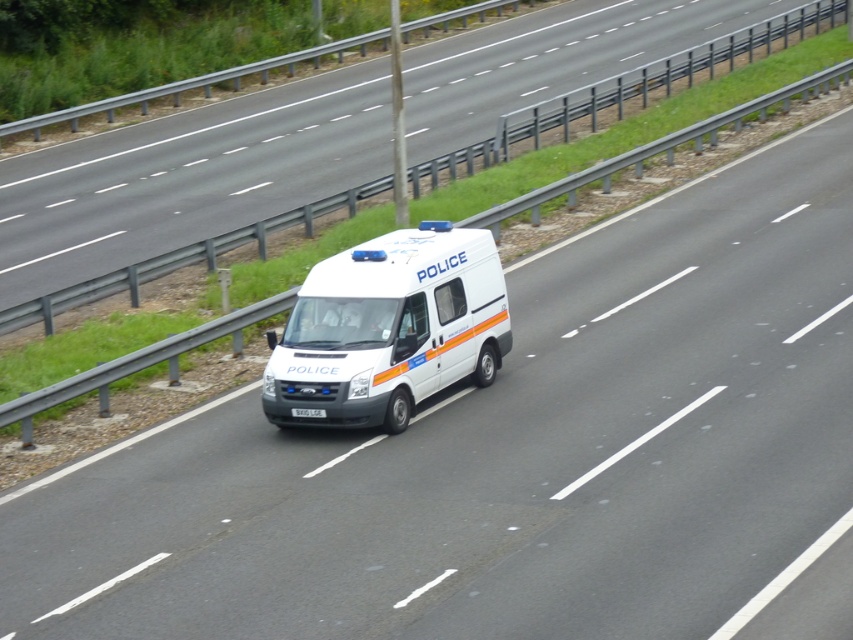
Question: Is white matte van at center smaller than white plastic license plate at center?

Choices:
 (A) no
 (B) yes

Answer: (A)

Question: Is the position of white glossy van at center more distant than that of white plastic license plate at center?

Choices:
 (A) no
 (B) yes

Answer: (B)

Question: Estimate the real-world distances between objects in this image. Which object is farther from the white plastic license plate at center?

Choices:
 (A) white matte van at center
 (B) white glossy van at center

Answer: (B)

Question: Which point is farther to the camera?

Choices:
 (A) white matte van at center
 (B) white plastic license plate at center

Answer: (B)

Question: Is white matte van at center below white glossy van at center?

Choices:
 (A) yes
 (B) no

Answer: (A)

Question: Which object is farther from the camera taking this photo?

Choices:
 (A) white plastic license plate at center
 (B) white matte van at center

Answer: (A)